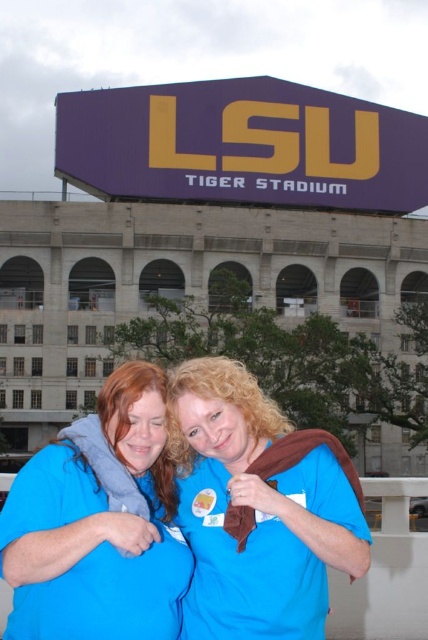
Question: Which of the following is the closest to the observer?

Choices:
 (A) (5, 548)
 (B) (309, 524)

Answer: (A)

Question: Is blue fabric at center bigger than blue fabric shirt at center?

Choices:
 (A) yes
 (B) no

Answer: (A)

Question: Among these objects, which one is nearest to the camera?

Choices:
 (A) blue fabric shirt at center
 (B) blue fabric at center

Answer: (A)

Question: Observing the image, what is the correct spatial positioning of blue fabric at center in reference to blue fabric shirt at center?

Choices:
 (A) right
 (B) left

Answer: (A)

Question: Does blue fabric at center appear on the right side of blue fabric shirt at center?

Choices:
 (A) no
 (B) yes

Answer: (B)